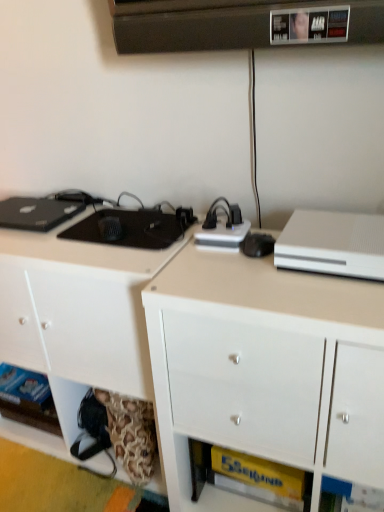
Question: Looking at their shapes, would you say white matte desktop computer at upper right is wider or thinner than white glossy cabinet at center, placed as the second cabinetry when sorted from left to right?

Choices:
 (A) wide
 (B) thin

Answer: (B)

Question: From a real-world perspective, relative to white glossy cabinet at center, placed as the second cabinetry when sorted from left to right, is white matte desktop computer at upper right vertically above or below?

Choices:
 (A) above
 (B) below

Answer: (A)

Question: Based on their relative distances, which object is farther from the white glossy cabinet at center, marked as the first cabinetry in a right-to-left arrangement?

Choices:
 (A) white matte cabinet at lower left, which ranks as the first cabinetry in left-to-right order
 (B) white matte desktop computer at upper right

Answer: (A)

Question: Which object is positioned farthest from the white glossy cabinet at center, marked as the first cabinetry in a right-to-left arrangement?

Choices:
 (A) white matte desktop computer at upper right
 (B) white matte cabinet at lower left, which ranks as the first cabinetry in left-to-right order

Answer: (B)